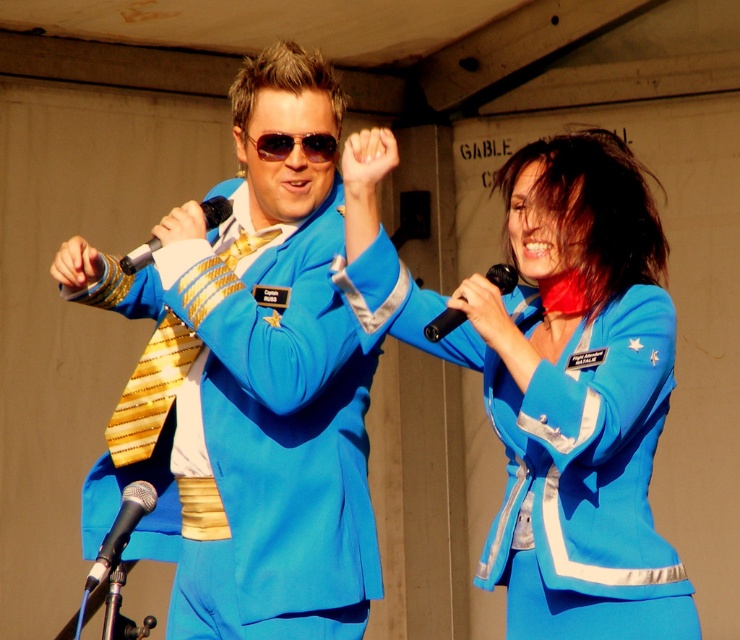
Question: In this image, where is matte blue suit at center located relative to blue satin suit at center?

Choices:
 (A) right
 (B) left

Answer: (B)

Question: In this image, where is blue satin suit at center located relative to black metallic microphone at center?

Choices:
 (A) below
 (B) above

Answer: (A)

Question: Which of these objects is positioned closest to the black plastic microphone at center?

Choices:
 (A) black metallic microphone at lower left
 (B) blue satin suit at center
 (C) black metallic microphone at center
 (D) gold shiny tie at center

Answer: (B)

Question: Which point appears farthest from the camera in this image?

Choices:
 (A) 134,266
 (B) 148,499
 (C) 246,410

Answer: (C)

Question: Which point is farther to the camera?

Choices:
 (A) blue satin suit at center
 (B) matte blue suit at center
 (C) gold shiny tie at center

Answer: (C)

Question: Observing the image, what is the correct spatial positioning of matte blue suit at center in reference to black plastic microphone at center?

Choices:
 (A) right
 (B) left

Answer: (B)